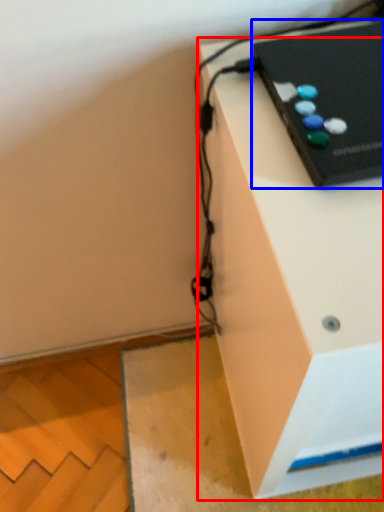
Question: Among these objects, which one is farthest to the camera, furniture (highlighted by a red box) or computer (highlighted by a blue box)?

Choices:
 (A) furniture
 (B) computer

Answer: (B)